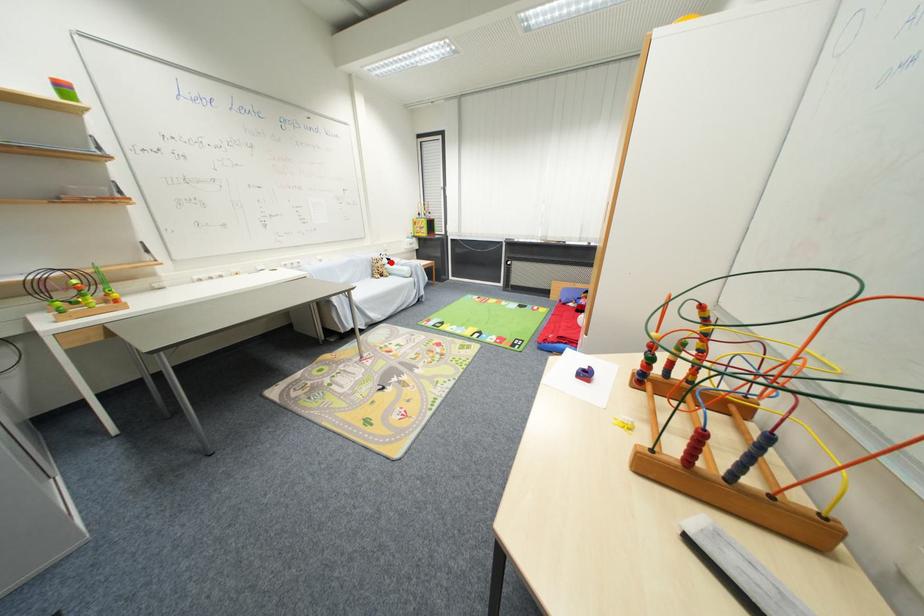
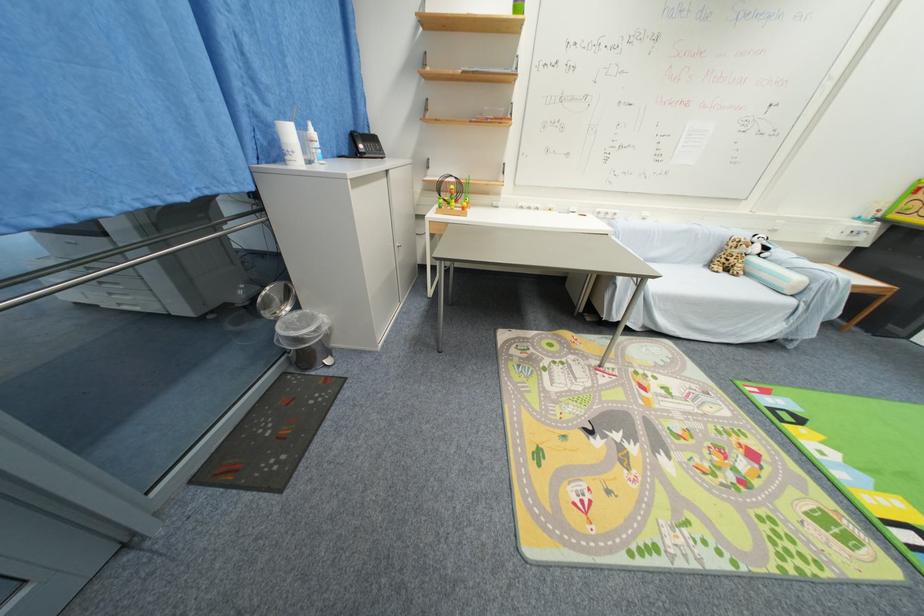
Find the pixel in the second image that matches the highlighted location in the first image.

(761, 251)